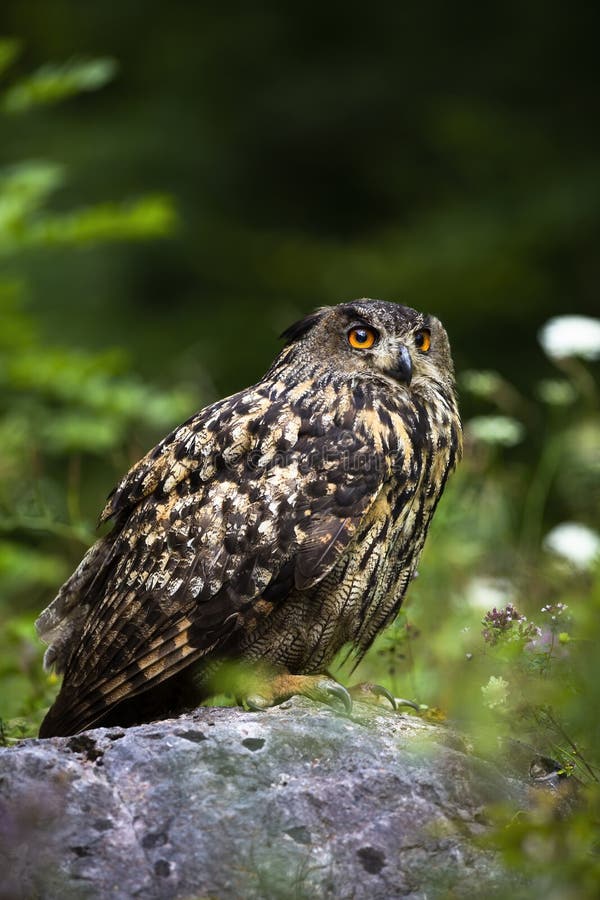
The image size is (600, 900). In order to click on the chest in this screenshot , I will do `click(388, 531)`.